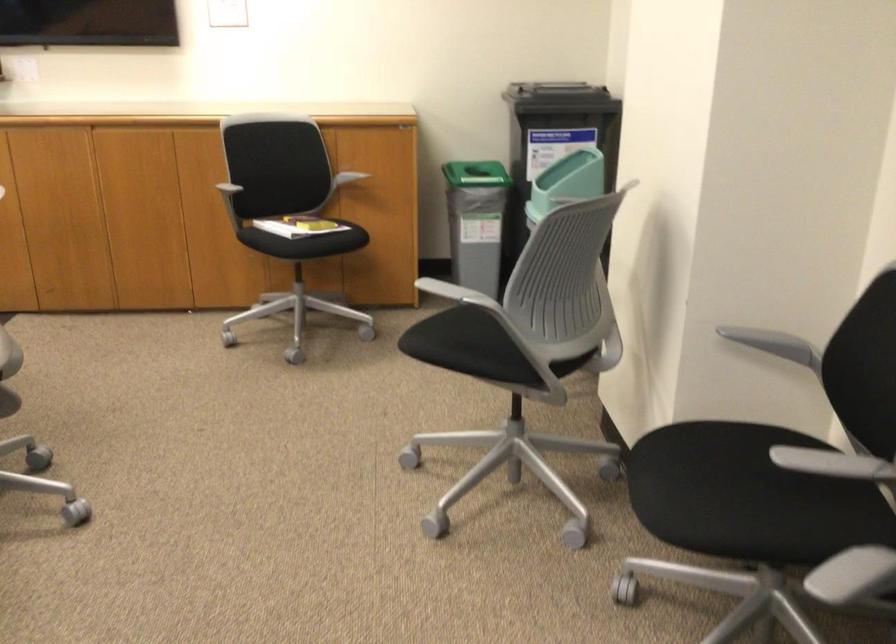
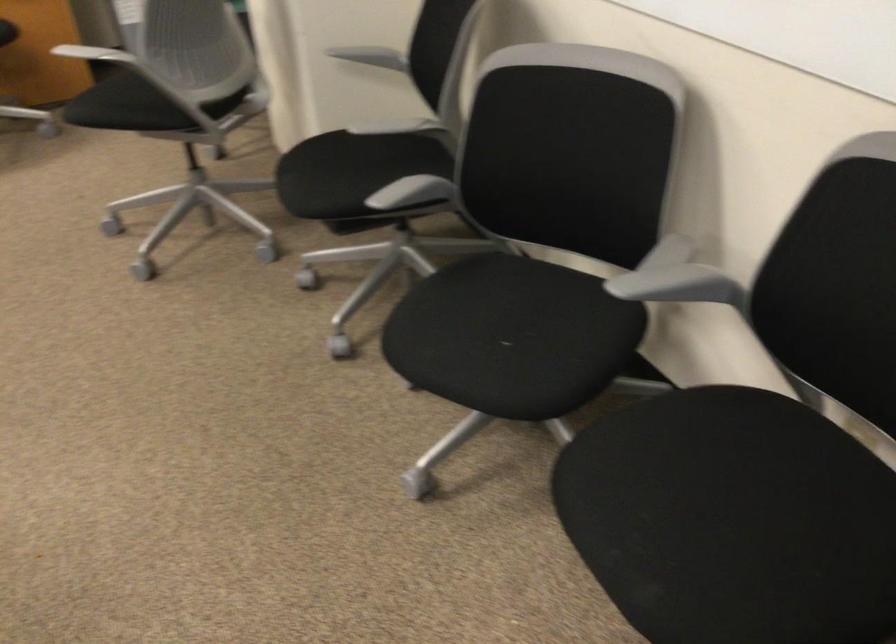
Locate, in the second image, the point that corresponds to [690,486] in the first image.

(319, 176)